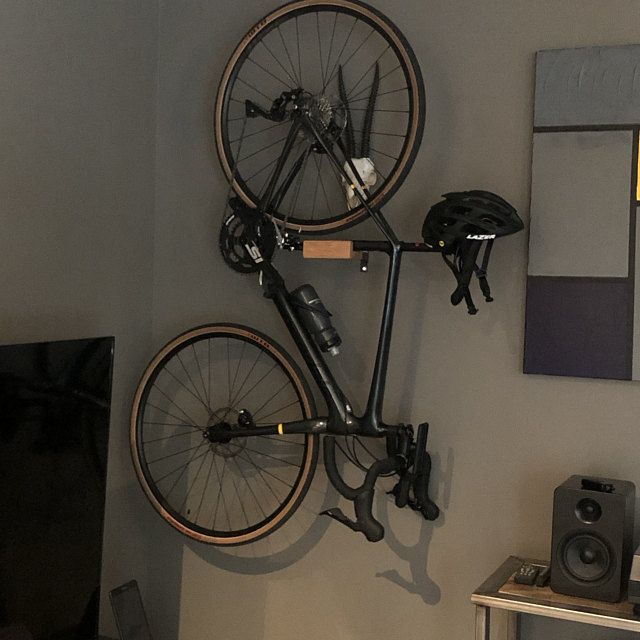
The height and width of the screenshot is (640, 640). Identify the location of wall hanging. (584, 209).